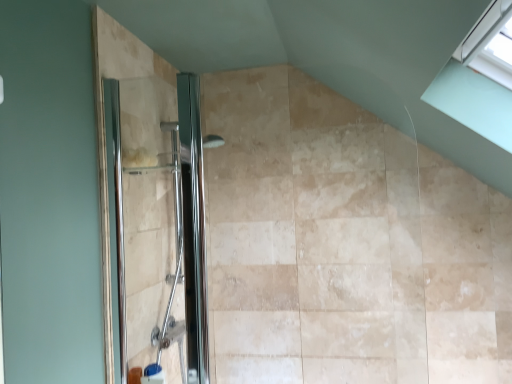
What do you see at coordinates (158, 220) in the screenshot? Image resolution: width=512 pixels, height=384 pixels. I see `clear glass shower door at left` at bounding box center [158, 220].

Where is `clear glass shower door at left`? clear glass shower door at left is located at coordinates (158, 220).

Find the location of `clear glass shower door at left`. clear glass shower door at left is located at coordinates (158, 220).